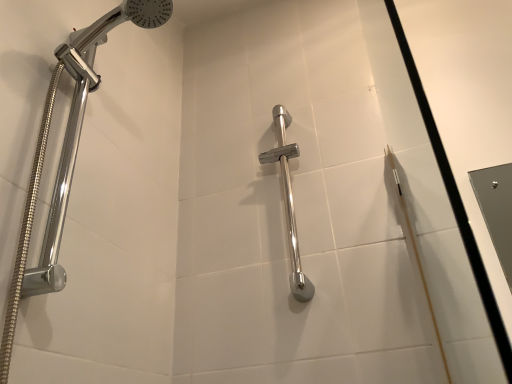
Question: Is polished chrome grab bar at center, which is the 1th shower from right to left, in front of or behind polished chrome shower head at left, the 1th shower in the front-to-back sequence, in the image?

Choices:
 (A) behind
 (B) front

Answer: (A)

Question: From a real-world perspective, is polished chrome grab bar at center, which is the 1th shower from right to left, physically located above or below polished chrome shower head at left, the 1th shower viewed from the left?

Choices:
 (A) above
 (B) below

Answer: (A)

Question: From the image's perspective, is polished chrome grab bar at center, acting as the 2th shower starting from the left, positioned above or below polished chrome shower head at left, the 1th shower in the front-to-back sequence?

Choices:
 (A) below
 (B) above

Answer: (A)

Question: In terms of height, does polished chrome shower head at left, the 2th shower in the back-to-front sequence, look taller or shorter compared to polished chrome grab bar at center, which ranks as the first shower in back-to-front order?

Choices:
 (A) short
 (B) tall

Answer: (B)

Question: Considering the positions of polished chrome shower head at left, which appears as the second shower when viewed from the right, and polished chrome grab bar at center, which is the 1th shower from right to left, in the image, is polished chrome shower head at left, which appears as the second shower when viewed from the right, wider or thinner than polished chrome grab bar at center, which is the 1th shower from right to left,?

Choices:
 (A) wide
 (B) thin

Answer: (A)

Question: In the image, is polished chrome shower head at left, the 1th shower viewed from the left, on the left side or the right side of polished chrome grab bar at center, which ranks as the first shower in back-to-front order?

Choices:
 (A) left
 (B) right

Answer: (A)

Question: From the image's perspective, is polished chrome shower head at left, the 1th shower viewed from the left, located above or below polished chrome grab bar at center, acting as the 2th shower starting from the left?

Choices:
 (A) above
 (B) below

Answer: (A)